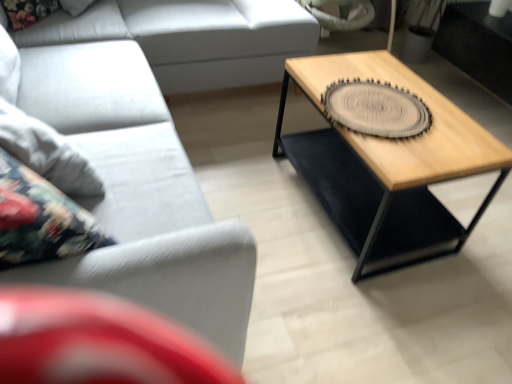
Question: From a real-world perspective, is gray textured coaster at center right physically below matte gray couch at lower left, which ranks as the 1th studio couch in front-to-back order?

Choices:
 (A) no
 (B) yes

Answer: (A)

Question: Can you confirm if gray textured coaster at center right is positioned to the left of matte gray couch at lower left, which ranks as the 1th studio couch in front-to-back order?

Choices:
 (A) no
 (B) yes

Answer: (A)

Question: Does gray textured coaster at center right have a greater height compared to matte gray couch at lower left, which ranks as the 1th studio couch in front-to-back order?

Choices:
 (A) yes
 (B) no

Answer: (B)

Question: Could matte gray couch at lower left, which is the 2th studio couch from back to front, be considered to be inside gray textured coaster at center right?

Choices:
 (A) no
 (B) yes

Answer: (A)

Question: Is gray textured coaster at center right oriented away from matte gray couch at lower left, which is the 2th studio couch from back to front?

Choices:
 (A) yes
 (B) no

Answer: (A)

Question: Relative to matte gray couch at lower left, which is the 2th studio couch from back to front, is wooden/black metal coffee table at right in front or behind?

Choices:
 (A) front
 (B) behind

Answer: (B)

Question: From the image's perspective, is wooden/black metal coffee table at right located above or below matte gray couch at lower left, which is the 2th studio couch from back to front?

Choices:
 (A) below
 (B) above

Answer: (A)

Question: Based on their positions, is wooden/black metal coffee table at right located to the left or right of matte gray couch at lower left, which is the 2th studio couch from back to front?

Choices:
 (A) right
 (B) left

Answer: (A)

Question: From a real-world perspective, is wooden/black metal coffee table at right positioned above or below matte gray couch at lower left, which ranks as the 1th studio couch in front-to-back order?

Choices:
 (A) below
 (B) above

Answer: (A)

Question: Is wooden/black metal coffee table at right in front of or behind light gray fabric couch at left, the 1th studio couch positioned from the back, in the image?

Choices:
 (A) front
 (B) behind

Answer: (A)

Question: From their relative heights in the image, would you say wooden/black metal coffee table at right is taller or shorter than light gray fabric couch at left, the 1th studio couch positioned from the back?

Choices:
 (A) short
 (B) tall

Answer: (A)

Question: Based on their positions, is wooden/black metal coffee table at right located to the left or right of light gray fabric couch at left, the 1th studio couch positioned from the back?

Choices:
 (A) right
 (B) left

Answer: (A)

Question: Choose the correct answer: Is wooden/black metal coffee table at right inside light gray fabric couch at left, marked as the 2th studio couch in a front-to-back arrangement, or outside it?

Choices:
 (A) inside
 (B) outside

Answer: (B)

Question: Do you think light gray fabric couch at left, marked as the 2th studio couch in a front-to-back arrangement, is within wooden/black metal coffee table at right, or outside of it?

Choices:
 (A) outside
 (B) inside

Answer: (A)

Question: From a real-world perspective, is light gray fabric couch at left, marked as the 2th studio couch in a front-to-back arrangement, physically located above or below wooden/black metal coffee table at right?

Choices:
 (A) below
 (B) above

Answer: (B)